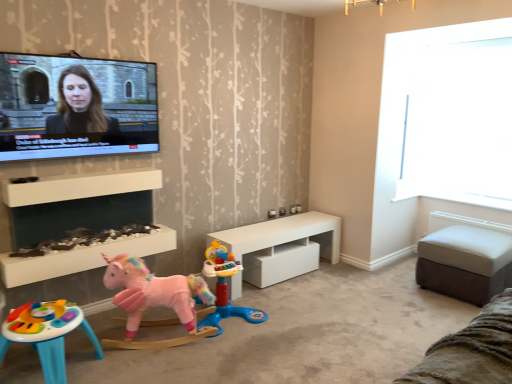
Question: In terms of height, does white glossy fireplace at lower left, marked as the second shelf in a top-to-bottom arrangement, look taller or shorter compared to white glossy table at center, the 2th table positioned from the right?

Choices:
 (A) short
 (B) tall

Answer: (A)

Question: Which is correct: white glossy fireplace at lower left, marked as the second shelf in a top-to-bottom arrangement, is inside white glossy table at center, the 2th table positioned from the right, or outside of it?

Choices:
 (A) outside
 (B) inside

Answer: (A)

Question: Which object is positioned farthest from the pink plush unicorn at lower left, arranged as the second toy when viewed from the left?

Choices:
 (A) pink fabric unicorn at lower left, the third toy in the left-to-right sequence
 (B) white glossy fireplace at lower left, marked as the second shelf in a top-to-bottom arrangement
 (C) white glossy table at center, which is the 1th table from left to right
 (D) plastic colorful table at lower left, the third toy from the right
 (E) matte black screen at upper left

Answer: (E)

Question: Which of these objects is positioned closest to the white leather ottoman at right, arranged as the 2th table when viewed from the left?

Choices:
 (A) white glossy fireplace at lower left, which is counted as the 1th shelf, starting from the bottom
 (B) pink fabric unicorn at lower left, which is the first toy in right-to-left order
 (C) transparent glass window at upper right
 (D) brown suede ottoman at lower right
 (E) matte black screen at upper left

Answer: (D)